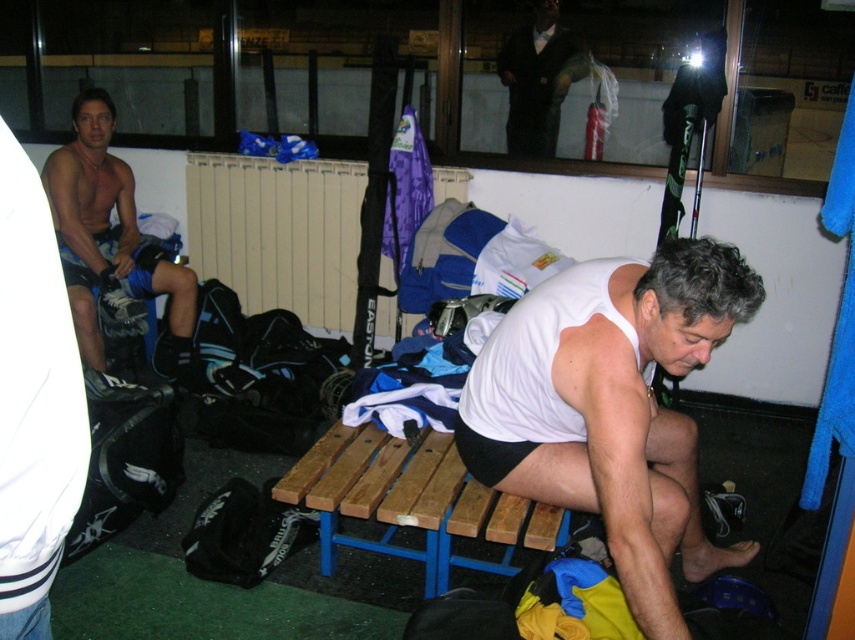
Between black fabric shorts at left and wooden bench at center, which one appears on the left side from the viewer's perspective?

black fabric shorts at left

The width and height of the screenshot is (855, 640). What do you see at coordinates (34, 401) in the screenshot?
I see `black fabric shorts at left` at bounding box center [34, 401].

What do you see at coordinates (34, 401) in the screenshot?
I see `black fabric shorts at left` at bounding box center [34, 401].

This screenshot has height=640, width=855. Find the location of `black fabric shorts at left`. black fabric shorts at left is located at coordinates (34, 401).

Does white matte tank top at center have a lesser height compared to black fabric shorts at left?

In fact, white matte tank top at center may be taller than black fabric shorts at left.

Is point (647, 548) less distant than point (86, 474)?

No, (647, 548) is further to viewer.

Is point (511, 316) positioned in front of point (28, 584)?

No, it is not.

Locate an element on the screen. This screenshot has height=640, width=855. white matte tank top at center is located at coordinates (611, 408).

Looking at this image, can you confirm if wooden bench at center is shorter than matte black shorts at left?

Indeed, wooden bench at center has a lesser height compared to matte black shorts at left.

Between wooden bench at center and matte black shorts at left, which one has less height?

Standing shorter between the two is wooden bench at center.

Measure the distance between wooden bench at center and camera.

A distance of 6.33 feet exists between wooden bench at center and camera.

Locate an element on the screen. wooden bench at center is located at coordinates (411, 500).